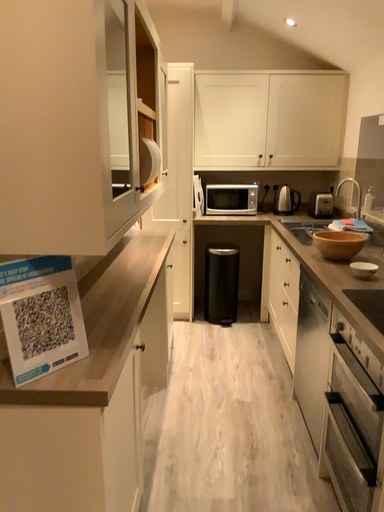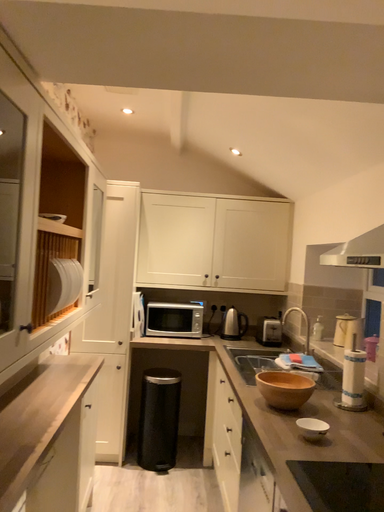
Question: Which way did the camera rotate in the video?

Choices:
 (A) rotated downward
 (B) rotated upward

Answer: (B)